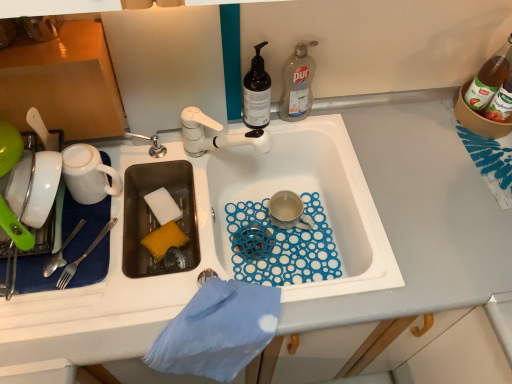
Identify the location of vacant point to the right of translucent dark brown bottle at upper center, the first bottle when ordered from left to right. This screenshot has height=384, width=512. (331, 129).